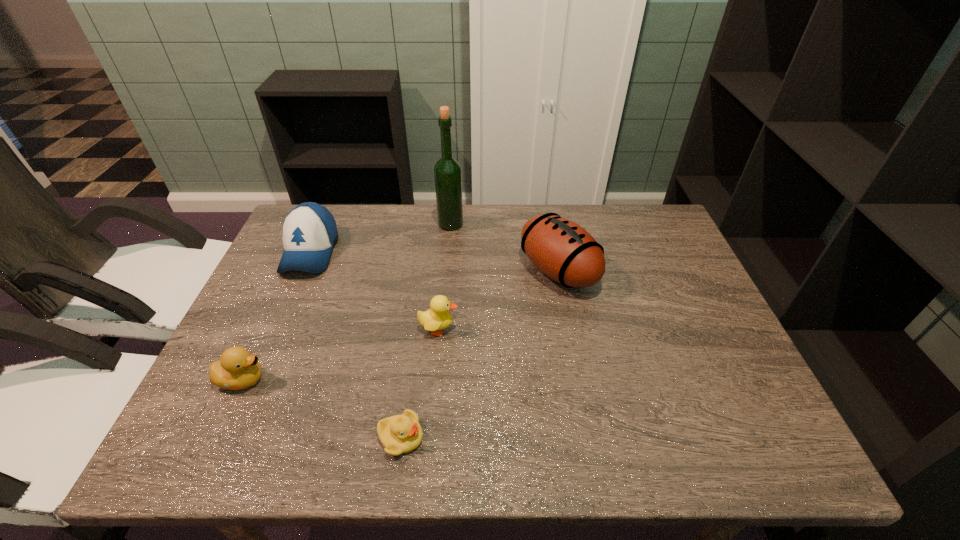
The image size is (960, 540). Find the location of `vacant area situated 0.250m on the front of the second tallest object`. vacant area situated 0.250m on the front of the second tallest object is located at coordinates (581, 385).

Identify the location of vacant area located 0.380m on the front-facing side of the third tallest object. (243, 405).

The height and width of the screenshot is (540, 960). I want to click on free space located 0.260m on the front-facing side of the fourth farthest object, so click(564, 329).

Locate an element on the screen. free point located 0.140m facing forward on the leftmost duckling is located at coordinates (331, 380).

The image size is (960, 540). I want to click on vacant space situated 0.120m at the face of the shortest duckling, so click(x=484, y=437).

Where is `liquor that is at the far edge`? Image resolution: width=960 pixels, height=540 pixels. liquor that is at the far edge is located at coordinates (448, 174).

Where is `football (American) located in the far edge section of the desktop`? football (American) located in the far edge section of the desktop is located at coordinates (561, 249).

Image resolution: width=960 pixels, height=540 pixels. In order to click on baseball cap at the far edge in this screenshot , I will do `click(309, 231)`.

You are a GUI agent. You are given a task and a screenshot of the screen. Output one action in this format:
    pyautogui.click(x=<x>, y=<y>)
    Task: Click on the object positioned at the near edge
    
    Given the screenshot: What is the action you would take?
    pyautogui.click(x=399, y=434)

This screenshot has height=540, width=960. Find the location of `baseball cap that is positioned at the left edge`. baseball cap that is positioned at the left edge is located at coordinates (309, 231).